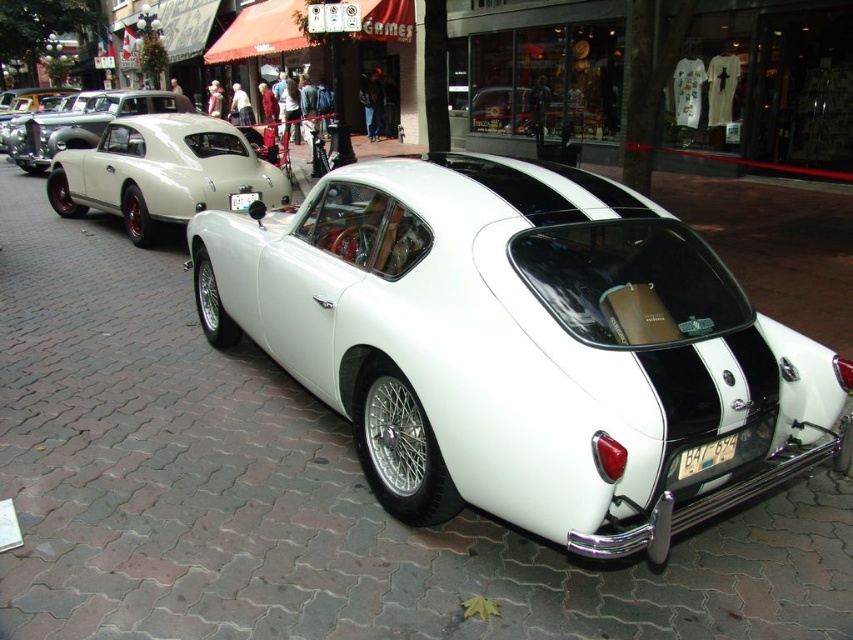
Based on the photo, you are a parking attendant who needs to verify the license plates of two vehicles. You see the white plastic license plate at lower right and the white plastic license plate at center. Which license plate takes up more space on the image?

The white plastic license plate at center takes up more space than the white plastic license plate at lower right.

You are standing on the cobblestone street in front of the white sports car. You notice two points marked on the car. One is at coordinate point (90, 124) and the other is at point (693, 449). Which point is closer to you?

Point (90, 124) is closer to you because it is further to the camera than point (693, 449).

You are a delivery person trying to park your van in the same spot where the white matte sports car at center is currently parked. However, there is a white plastic license plate at lower right in the way. Can you park your van there without moving the license plate?

The white matte sports car at center is positioned over white plastic license plate at lower right, so the license plate is part of the car and cannot be moved separately. Therefore, you can park your van in that spot since the license plate is attached to the car and will move with it.